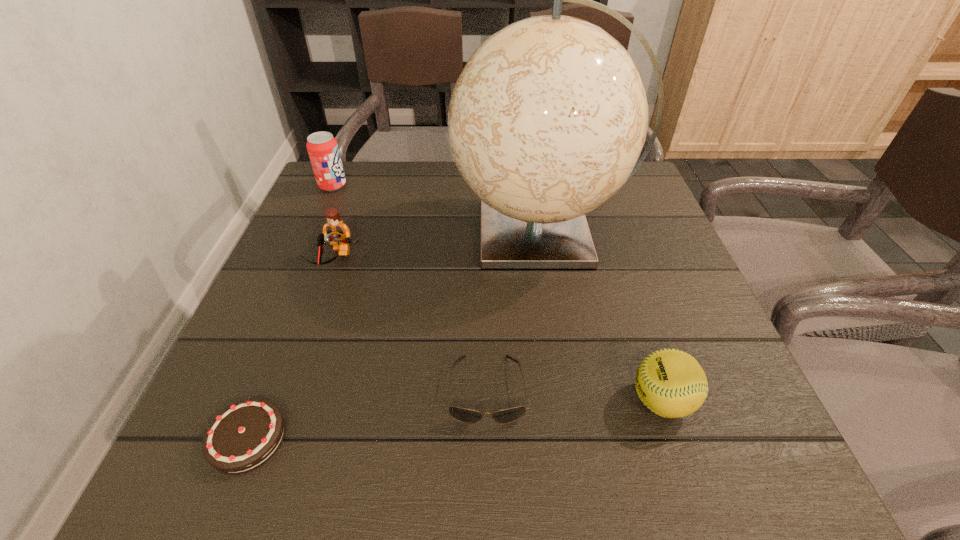
The image size is (960, 540). What are the coordinates of `vacant area between the chocolate cake and the soda can` in the screenshot? It's located at (290, 312).

This screenshot has height=540, width=960. I want to click on empty location between the sunglasses and the chocolate cake, so click(x=368, y=414).

The height and width of the screenshot is (540, 960). In order to click on unoccupied area between the second shortest object and the softball in this screenshot , I will do `click(574, 395)`.

Find the location of `unoccupied area between the sunglasses and the chocolate cake`. unoccupied area between the sunglasses and the chocolate cake is located at coordinates click(x=368, y=414).

Image resolution: width=960 pixels, height=540 pixels. In order to click on vacant region between the sunglasses and the chocolate cake in this screenshot , I will do `click(368, 414)`.

Identify the location of unoccupied position between the softball and the soda can. The width and height of the screenshot is (960, 540). (497, 293).

I want to click on vacant area that lies between the softball and the second shortest object, so click(x=574, y=395).

Identify which object is located as the second nearest to the sunglasses. Please provide its 2D coordinates. Your answer should be formatted as a tuple, i.e. [(x, y)], where the tuple contains the x and y coordinates of a point satisfying the conditions above.

[(671, 383)]

Identify which object is located as the nearest to the fifth tallest object. Please provide its 2D coordinates. Your answer should be formatted as a tuple, i.e. [(x, y)], where the tuple contains the x and y coordinates of a point satisfying the conditions above.

[(546, 122)]

Where is `vacant region that satisfies the following two spatial constraints: 1. on the surface of the fifth shortest object; 2. on the back side of the shortest object`? The height and width of the screenshot is (540, 960). vacant region that satisfies the following two spatial constraints: 1. on the surface of the fifth shortest object; 2. on the back side of the shortest object is located at coordinates (222, 438).